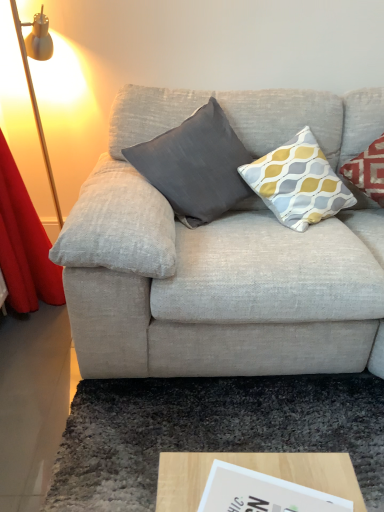
Question: Can you confirm if dark gray shaggy rug at lower center is thinner than dark gray fabric pillow at center, the 2th pillow from the right?

Choices:
 (A) no
 (B) yes

Answer: (A)

Question: Does dark gray shaggy rug at lower center touch dark gray fabric pillow at center, the 2th pillow from the right?

Choices:
 (A) yes
 (B) no

Answer: (B)

Question: Could dark gray fabric pillow at center, the 1th pillow positioned from the left, be considered to be inside dark gray shaggy rug at lower center?

Choices:
 (A) yes
 (B) no

Answer: (B)

Question: Considering the relative sizes of dark gray shaggy rug at lower center and dark gray fabric pillow at center, the 1th pillow positioned from the left, in the image provided, is dark gray shaggy rug at lower center wider than dark gray fabric pillow at center, the 1th pillow positioned from the left,?

Choices:
 (A) yes
 (B) no

Answer: (A)

Question: Is dark gray shaggy rug at lower center positioned in front of dark gray fabric pillow at center, the 2th pillow from the right?

Choices:
 (A) no
 (B) yes

Answer: (B)

Question: From a real-world perspective, is dark gray shaggy rug at lower center beneath dark gray fabric pillow at center, the 1th pillow positioned from the left?

Choices:
 (A) yes
 (B) no

Answer: (A)

Question: Would you say wooden at lower center is outside dark gray fabric pillow at center, the 1th pillow positioned from the left?

Choices:
 (A) yes
 (B) no

Answer: (A)

Question: Is wooden at lower center to the left of dark gray fabric pillow at center, the 1th pillow positioned from the left, from the viewer's perspective?

Choices:
 (A) yes
 (B) no

Answer: (B)

Question: From a real-world perspective, does wooden at lower center stand above dark gray fabric pillow at center, the 2th pillow from the right?

Choices:
 (A) yes
 (B) no

Answer: (B)

Question: Could you tell me if wooden at lower center is facing dark gray fabric pillow at center, the 2th pillow from the right?

Choices:
 (A) yes
 (B) no

Answer: (B)

Question: Are wooden at lower center and dark gray fabric pillow at center, the 2th pillow from the right, beside each other?

Choices:
 (A) yes
 (B) no

Answer: (B)

Question: Is wooden at lower center not near dark gray fabric pillow at center, the 2th pillow from the right?

Choices:
 (A) no
 (B) yes

Answer: (B)

Question: From a real-world perspective, is dark gray fabric pillow at center, the 2th pillow from the right, on top of wooden at lower center?

Choices:
 (A) yes
 (B) no

Answer: (A)